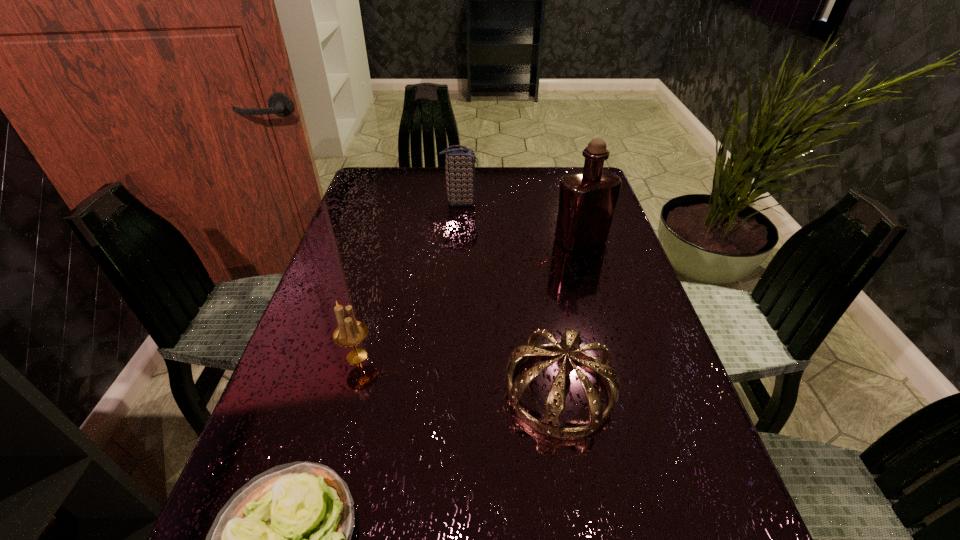
The width and height of the screenshot is (960, 540). In order to click on object that is at the far edge in this screenshot , I will do `click(460, 163)`.

Where is `object present at the left edge`? The height and width of the screenshot is (540, 960). object present at the left edge is located at coordinates (349, 333).

Find the location of a particular element. The height and width of the screenshot is (540, 960). liquor present at the right edge is located at coordinates (587, 200).

Where is `tiara at the right edge`? tiara at the right edge is located at coordinates (549, 425).

This screenshot has height=540, width=960. Find the location of `vacant space at the far edge of the desktop`. vacant space at the far edge of the desktop is located at coordinates (550, 198).

Find the location of a particular element. The image size is (960, 540). vacant space at the left edge of the desktop is located at coordinates (378, 215).

In the image, there is a desktop. Where is `free space at the right edge`? This screenshot has width=960, height=540. free space at the right edge is located at coordinates (632, 350).

Identify the location of blank space at the far left corner. (386, 177).

This screenshot has height=540, width=960. In the image, there is a desktop. In order to click on vacant space at the far right corner in this screenshot , I will do `click(555, 171)`.

Where is `free point between the tiara and the liquor`? free point between the tiara and the liquor is located at coordinates (570, 316).